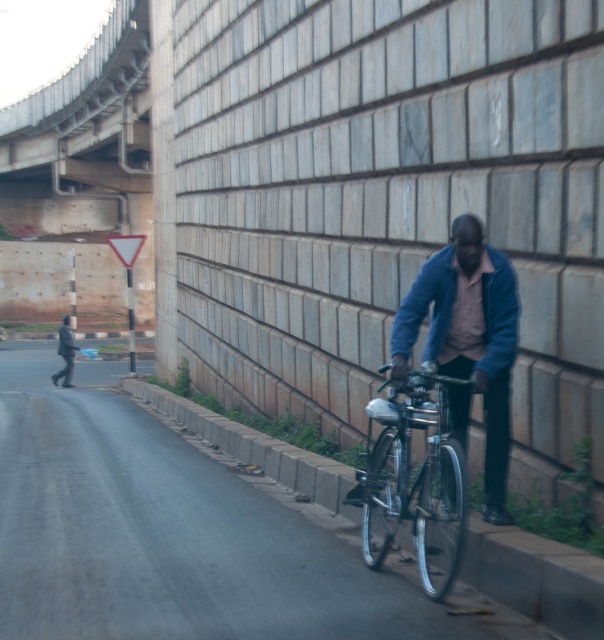
Question: Can you confirm if metallic bicycle at right is positioned above silver metallic bicycle at right?

Choices:
 (A) no
 (B) yes

Answer: (A)

Question: Which of the following is the farthest from the observer?

Choices:
 (A) blue fabric jacket at center
 (B) brushed metal overpass at upper left

Answer: (B)

Question: Can you confirm if silver metallic bicycle at right is positioned to the left of blue matte jacket at center?

Choices:
 (A) yes
 (B) no

Answer: (A)

Question: Estimate the real-world distances between objects in this image. Which object is closer to the silver metallic bicycle at right?

Choices:
 (A) metallic bicycle at right
 (B) blue fabric jacket at center
 (C) brushed metal overpass at upper left

Answer: (B)

Question: Is metallic bicycle at right to the left of brushed metal overpass at upper left from the viewer's perspective?

Choices:
 (A) no
 (B) yes

Answer: (A)

Question: Which of the following is the closest to the observer?

Choices:
 (A) (0, 424)
 (B) (466, 406)
 (C) (133, 19)

Answer: (B)